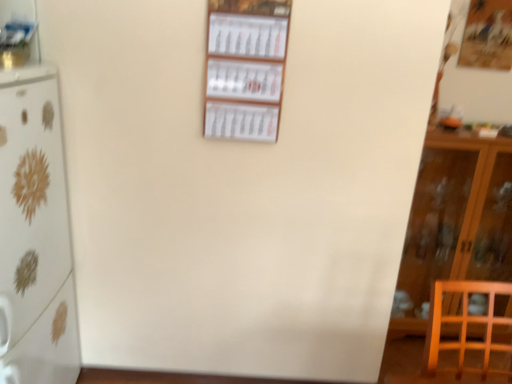
Question: From a real-world perspective, is white glossy refrigerator at left located higher than white paper calendar at center, the first shelf viewed from the right?

Choices:
 (A) no
 (B) yes

Answer: (A)

Question: Is white glossy refrigerator at left facing away from white paper calendar at center, the first shelf viewed from the right?

Choices:
 (A) no
 (B) yes

Answer: (A)

Question: From a real-world perspective, is white glossy refrigerator at left located beneath white paper calendar at center, which is the 2th shelf in left-to-right order?

Choices:
 (A) yes
 (B) no

Answer: (A)

Question: Could white paper calendar at center, which is the 2th shelf in left-to-right order, be considered to be inside white glossy refrigerator at left?

Choices:
 (A) yes
 (B) no

Answer: (B)

Question: Is white glossy refrigerator at left at the right side of white paper calendar at center, which is the 2th shelf in left-to-right order?

Choices:
 (A) yes
 (B) no

Answer: (B)

Question: From a real-world perspective, relative to wooden cabinet at right, is white paper calendar at center, the first shelf viewed from the right, vertically above or below?

Choices:
 (A) above
 (B) below

Answer: (A)

Question: Based on their sizes in the image, would you say white paper calendar at center, the first shelf viewed from the right, is bigger or smaller than wooden cabinet at right?

Choices:
 (A) big
 (B) small

Answer: (B)

Question: Does point (249, 97) appear closer or farther from the camera than point (510, 168)?

Choices:
 (A) farther
 (B) closer

Answer: (B)

Question: Is white paper calendar at center, which is the 2th shelf in left-to-right order, inside or outside of wooden cabinet at right?

Choices:
 (A) inside
 (B) outside

Answer: (B)

Question: In terms of width, does wooden cabinet at right look wider or thinner when compared to metallic silver shelf at upper left, the first shelf viewed from the left?

Choices:
 (A) wide
 (B) thin

Answer: (A)

Question: Considering their positions, is wooden cabinet at right located in front of or behind metallic silver shelf at upper left, the first shelf viewed from the left?

Choices:
 (A) behind
 (B) front

Answer: (A)

Question: In terms of height, does wooden cabinet at right look taller or shorter compared to metallic silver shelf at upper left, which is the 2th shelf from right to left?

Choices:
 (A) tall
 (B) short

Answer: (A)

Question: In the image, is wooden cabinet at right on the left side or the right side of metallic silver shelf at upper left, the first shelf viewed from the left?

Choices:
 (A) left
 (B) right

Answer: (B)

Question: From their relative heights in the image, would you say wooden cabinet at right is taller or shorter than white glossy refrigerator at left?

Choices:
 (A) short
 (B) tall

Answer: (A)

Question: In the image, is wooden cabinet at right positioned in front of or behind white glossy refrigerator at left?

Choices:
 (A) behind
 (B) front

Answer: (A)